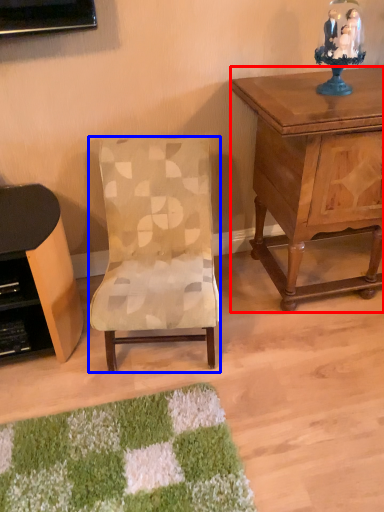
Question: Which object appears farthest to the camera in this image, nightstand (highlighted by a red box) or chair (highlighted by a blue box)?

Choices:
 (A) nightstand
 (B) chair

Answer: (A)